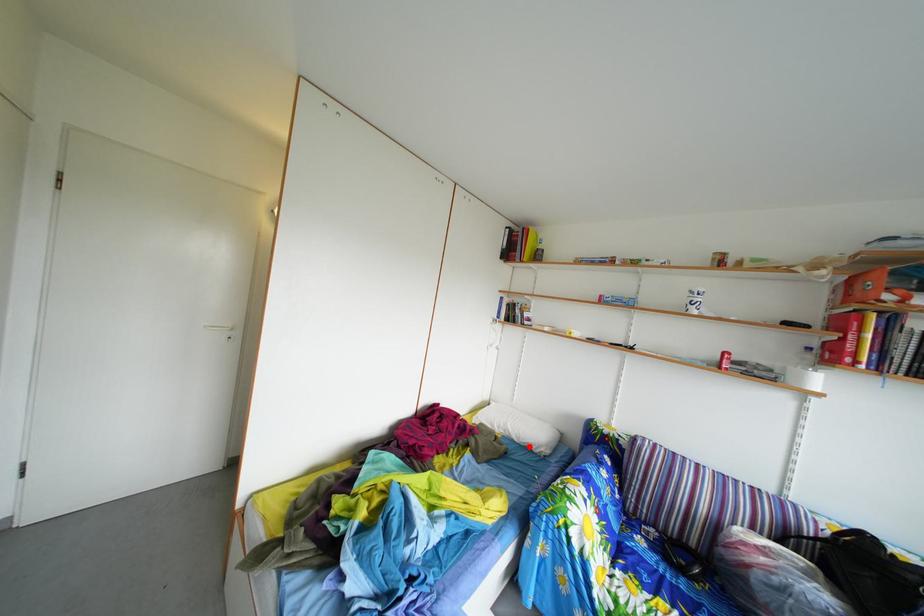
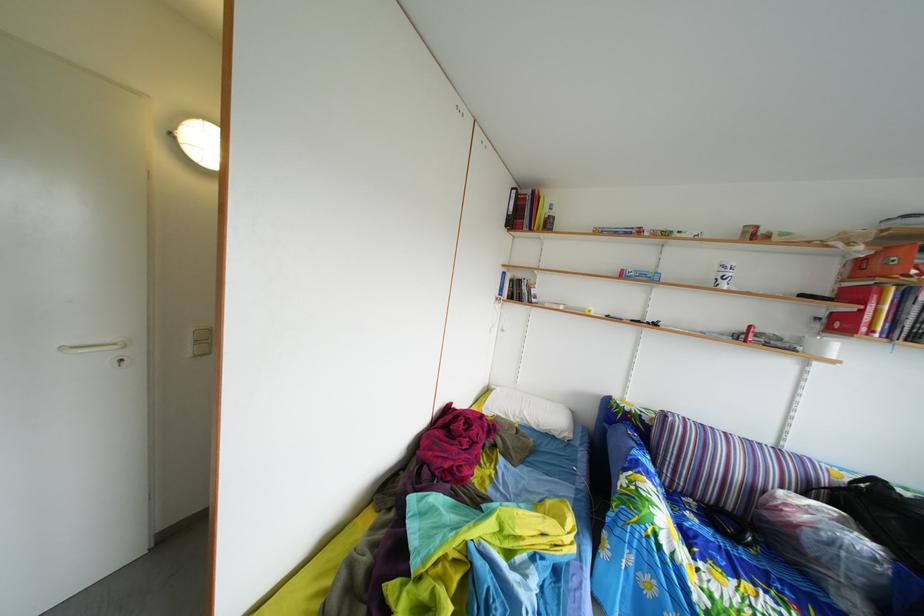
Where in the second image is the point corresponding to the highlighted location from the first image?

(549, 434)